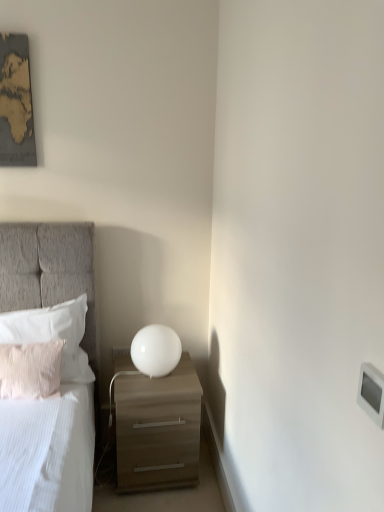
Question: Relative to white soft pillow at left, placed as the first pillow when sorted from back to front, is white plastic electric outlet at lower right in front or behind?

Choices:
 (A) behind
 (B) front

Answer: (A)

Question: Is white plastic electric outlet at lower right to the left or to the right of white soft pillow at left, placed as the first pillow when sorted from back to front, in the image?

Choices:
 (A) right
 (B) left

Answer: (A)

Question: Estimate the real-world distances between objects in this image. Which object is closer to the beige textured pillow at left, the second pillow from the back?

Choices:
 (A) white soft pillow at left, placed as the first pillow when sorted from back to front
 (B) white glossy sphere at center
 (C) white plastic electric outlet at lower right
 (D) white plastic light switch at upper right
 (E) matte wood drawer at lower left

Answer: (A)

Question: Estimate the real-world distances between objects in this image. Which object is closer to the white soft pillow at left, the 2th pillow from the front?

Choices:
 (A) beige textured pillow at left, the second pillow from the back
 (B) white plastic electric outlet at lower right
 (C) white glossy sphere at center
 (D) matte wood drawer at lower left
 (E) white plastic light switch at upper right

Answer: (A)